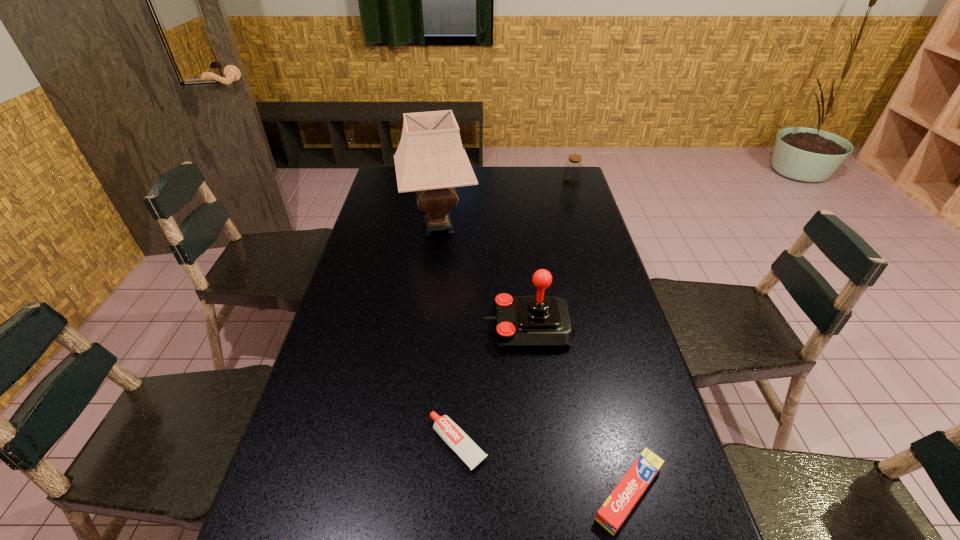
This screenshot has height=540, width=960. I want to click on free spot that satisfies the following two spatial constraints: 1. on the front side of the left toothpaste; 2. on the left side of the right toothpaste, so click(456, 493).